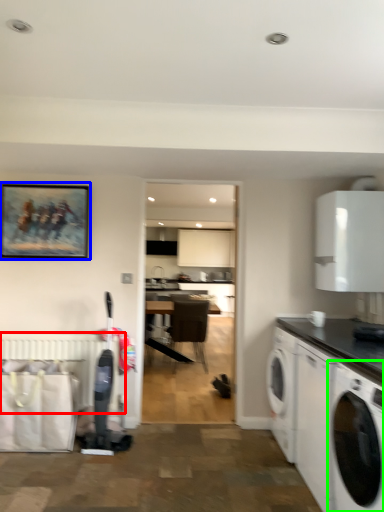
Question: Estimate the real-world distances between objects in this image. Which object is farther from radiator (highlighted by a red box), picture frame (highlighted by a blue box) or washing machine (highlighted by a green box)?

Choices:
 (A) picture frame
 (B) washing machine

Answer: (B)